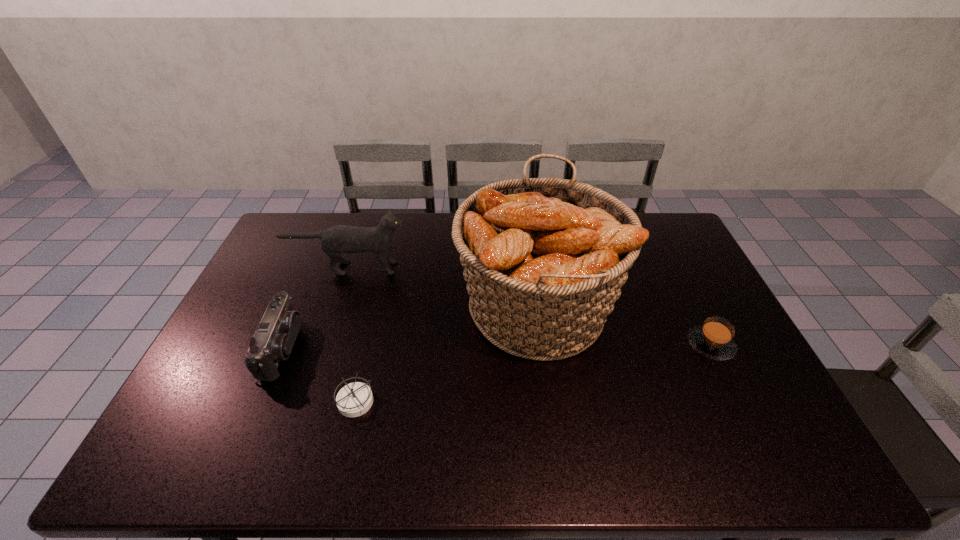
At what (x,y) coordinates should I click in order to perform the action: click on free space located on the back of the compass. Please return your answer as a coordinate pair (x, y). The width and height of the screenshot is (960, 540). Looking at the image, I should click on (368, 350).

Image resolution: width=960 pixels, height=540 pixels. In order to click on cat that is at the left edge in this screenshot , I will do `click(338, 239)`.

The image size is (960, 540). I want to click on camcorder that is at the left edge, so click(275, 336).

Locate an element on the screen. The width and height of the screenshot is (960, 540). object situated at the right edge is located at coordinates (714, 339).

At what (x,y) coordinates should I click in order to perform the action: click on free location at the far edge of the desktop. Please return your answer as a coordinate pair (x, y). Looking at the image, I should click on (424, 214).

You are a GUI agent. You are given a task and a screenshot of the screen. Output one action in this format:
    pyautogui.click(x=<x>, y=<y>)
    Task: Click on the vacant space at the near edge
    This screenshot has width=960, height=540.
    Given the screenshot: What is the action you would take?
    pyautogui.click(x=651, y=466)

Where is `vacant position at the left edge of the desktop`? Image resolution: width=960 pixels, height=540 pixels. vacant position at the left edge of the desktop is located at coordinates (207, 422).

In the image, there is a desktop. Identify the location of vacant region at the right edge. (677, 260).

The image size is (960, 540). I want to click on free space between the rightmost object and the basket, so click(624, 327).

Where is `vacant region between the cappuccino and the basket`? The width and height of the screenshot is (960, 540). vacant region between the cappuccino and the basket is located at coordinates (624, 327).